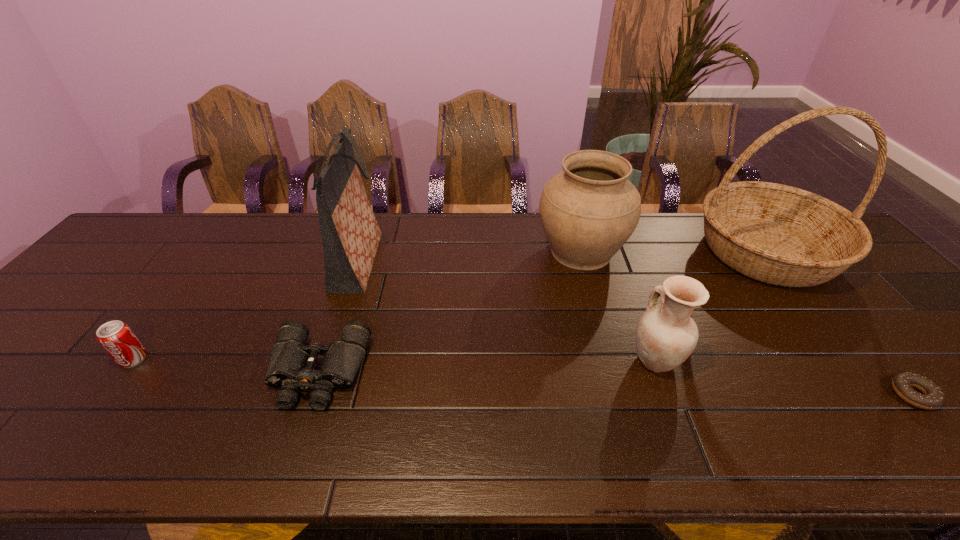
Image resolution: width=960 pixels, height=540 pixels. I want to click on basket, so click(x=781, y=235).

The height and width of the screenshot is (540, 960). Find the location of `the second tallest object`. the second tallest object is located at coordinates (350, 233).

Find the location of a particular element. urn is located at coordinates point(588,211).

Image resolution: width=960 pixels, height=540 pixels. I want to click on pottery, so click(x=666, y=335).

Identify the location of soda can. This screenshot has width=960, height=540. (116, 337).

Image resolution: width=960 pixels, height=540 pixels. Identify the location of the third shortest object. (116, 337).

I want to click on binoculars, so click(x=291, y=365).

Identify the location of the shortest object. The image size is (960, 540). (932, 398).

Identify the location of free spot located on the left of the basket. (611, 252).

Identify the location of free space located on the front-facing side of the sixth shortest object. (503, 261).